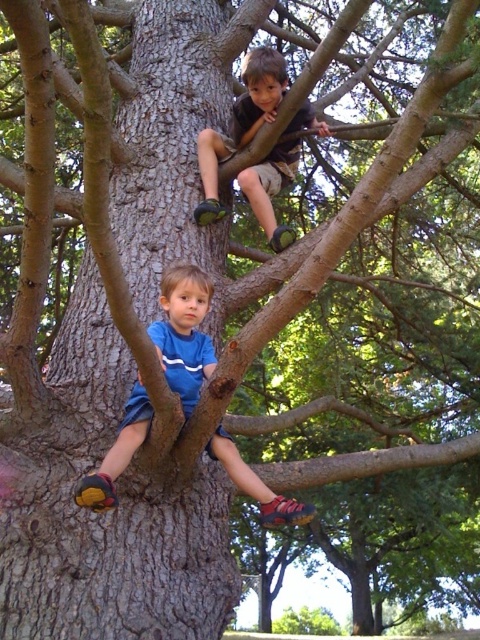
Based on the photo, you are a parent trying to locate your children in the tree. You notice two pairs of shorts on the tree. Which pair, the blue fabric shorts at lower left or the matte brown shorts at upper center, is positioned lower on the tree?

The blue fabric shorts at lower left is positioned lower on the tree than the matte brown shorts at upper center.

You are a parent trying to ensure the safety of your children. You see the blue fabric shorts at lower left and the matte brown shorts at upper center in the tree. How far apart are the two children from each other?

The blue fabric shorts at lower left is 6.25 feet away from matte brown shorts at upper center, so the two children are 6.25 feet apart.

Based on the photo, you are a parent observing two children climbing a tree. You notice the blue fabric shorts at lower left and the matte brown shorts at upper center. Which child is wearing thinner shorts?

The blue fabric shorts at lower left are thinner than the matte brown shorts at upper center, so the child wearing the blue fabric shorts at lower left has thinner shorts.